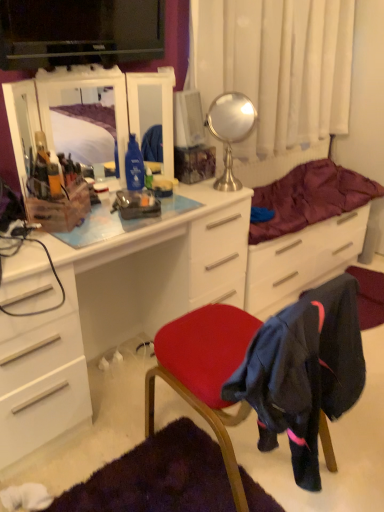
Question: Is matte black television at upper center turned away from white glossy chest of drawers at center?

Choices:
 (A) yes
 (B) no

Answer: (B)

Question: From a real-world perspective, is matte black television at upper center on top of white glossy chest of drawers at center?

Choices:
 (A) no
 (B) yes

Answer: (B)

Question: Is matte black television at upper center positioned in front of white glossy chest of drawers at center?

Choices:
 (A) yes
 (B) no

Answer: (B)

Question: Does matte black television at upper center contain white glossy chest of drawers at center?

Choices:
 (A) no
 (B) yes

Answer: (A)

Question: Is matte black television at upper center at the right side of white glossy chest of drawers at center?

Choices:
 (A) no
 (B) yes

Answer: (B)

Question: Does matte black television at upper center have a smaller size compared to white glossy chest of drawers at center?

Choices:
 (A) yes
 (B) no

Answer: (A)

Question: Is white sheer curtain at upper center oriented away from maroon quilted blanket at center?

Choices:
 (A) yes
 (B) no

Answer: (B)

Question: Can you confirm if white sheer curtain at upper center is smaller than maroon quilted blanket at center?

Choices:
 (A) yes
 (B) no

Answer: (B)

Question: Is white sheer curtain at upper center thinner than maroon quilted blanket at center?

Choices:
 (A) yes
 (B) no

Answer: (A)

Question: From the image's perspective, is white sheer curtain at upper center over maroon quilted blanket at center?

Choices:
 (A) no
 (B) yes

Answer: (B)

Question: Is the surface of white sheer curtain at upper center in direct contact with maroon quilted blanket at center?

Choices:
 (A) yes
 (B) no

Answer: (B)

Question: Does white sheer curtain at upper center appear on the left side of maroon quilted blanket at center?

Choices:
 (A) yes
 (B) no

Answer: (A)

Question: Would you say white glossy chest of drawers at center is a long distance from polished silver mirror at upper center, placed as the 1th mirror when sorted from right to left?

Choices:
 (A) no
 (B) yes

Answer: (A)